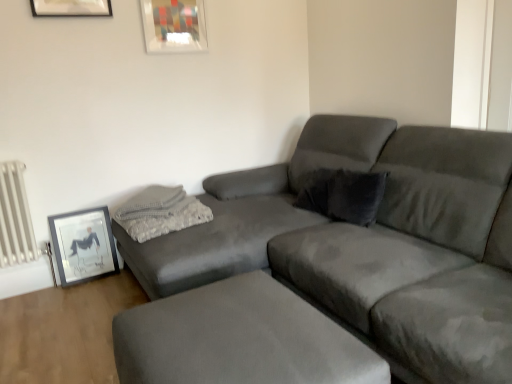
Question: Is matte glass picture frame at upper center, which is the first picture frame from top to bottom, to the left or to the right of white metallic radiator at left in the image?

Choices:
 (A) right
 (B) left

Answer: (A)

Question: From the image's perspective, is matte glass picture frame at upper center, the 2th picture frame viewed from the left, above or below white metallic radiator at left?

Choices:
 (A) below
 (B) above

Answer: (B)

Question: Considering the real-world distances, which object is closest to the suede footrest at lower center?

Choices:
 (A) white metallic radiator at left
 (B) velvet gray pillow at upper right, marked as the 2th pillow in a left-to-right arrangement
 (C) matte black picture frame at lower left, the first picture frame positioned from the left
 (D) gray textured pillow at upper left, which ranks as the second pillow in right-to-left order
 (E) suede gray couch at center

Answer: (E)

Question: Considering the real-world distances, which object is farthest from the matte black picture frame at lower left, acting as the 2th picture frame starting from the top?

Choices:
 (A) matte glass picture frame at upper center, positioned as the second picture frame in bottom-to-top order
 (B) suede footrest at lower center
 (C) gray textured pillow at upper left, which ranks as the second pillow in right-to-left order
 (D) velvet gray pillow at upper right, marked as the 2th pillow in a left-to-right arrangement
 (E) white metallic radiator at left

Answer: (B)